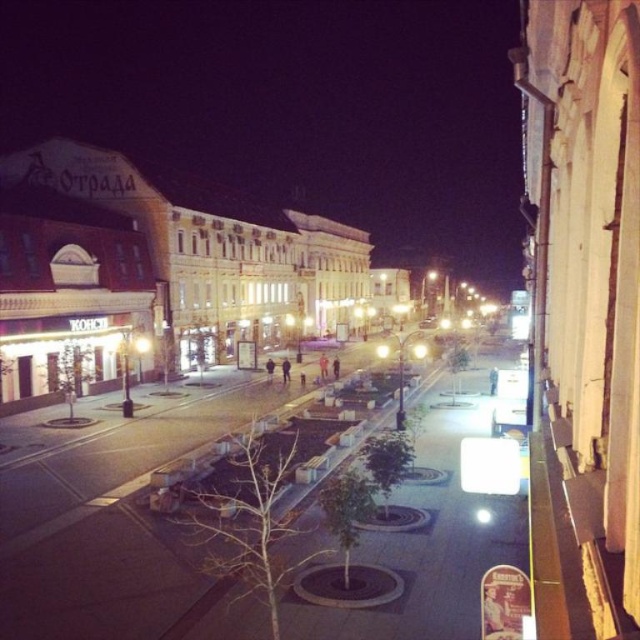
Can you confirm if smooth concrete benches at center is thinner than white painted building at left?

Indeed, smooth concrete benches at center has a lesser width compared to white painted building at left.

Does point (205, 404) lie in front of point (208, 244)?

Yes, it is.

Locate an element on the screen. Image resolution: width=640 pixels, height=640 pixels. smooth concrete benches at center is located at coordinates (124, 518).